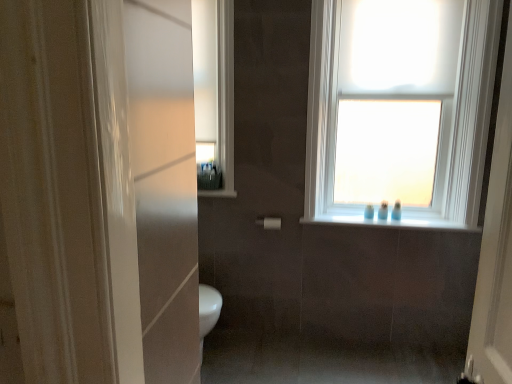
Where is `free space to the left of blue plastic bottle at upper right, which is counted as the 2th toiletry, starting from the left`? free space to the left of blue plastic bottle at upper right, which is counted as the 2th toiletry, starting from the left is located at coordinates (349, 218).